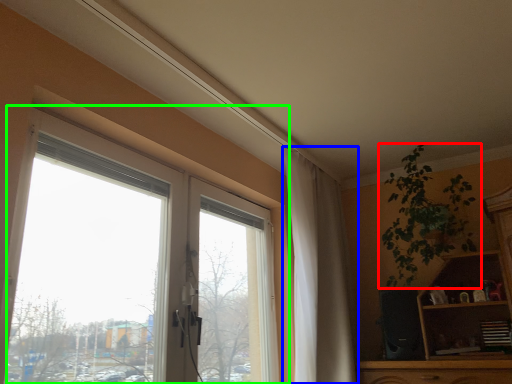
Question: Which object is positioned farthest from houseplant (highlighted by a red box)? Select from curtain (highlighted by a blue box) and window (highlighted by a green box).

Choices:
 (A) curtain
 (B) window

Answer: (B)